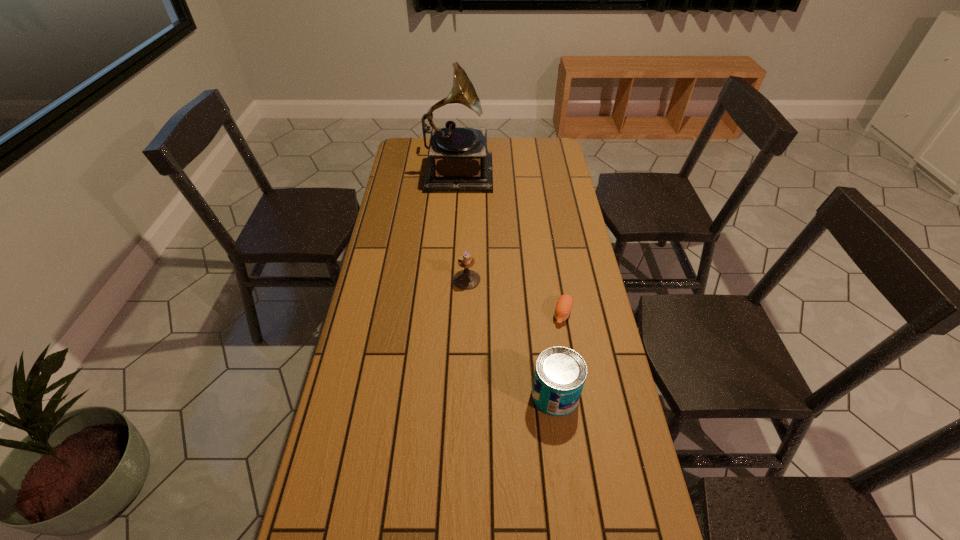
Where is `the tallest object`? This screenshot has width=960, height=540. the tallest object is located at coordinates (458, 160).

You are a GUI agent. You are given a task and a screenshot of the screen. Output one action in this format:
    pyautogui.click(x=<x>, y=<y>)
    Task: Click on the record player
    The height and width of the screenshot is (540, 960).
    Given the screenshot: What is the action you would take?
    pyautogui.click(x=458, y=160)

I want to click on candle holder, so click(466, 279).

This screenshot has width=960, height=540. What are the coordinates of `the nearest object` in the screenshot? It's located at (560, 373).

Where is `the shortest object`? the shortest object is located at coordinates (563, 308).

The width and height of the screenshot is (960, 540). I want to click on sushi, so click(x=563, y=308).

Where is `free space located on the horn of the record player`? This screenshot has width=960, height=540. free space located on the horn of the record player is located at coordinates (538, 170).

Identify the location of free region located 0.090m on the right of the third nearest object. (507, 280).

Image resolution: width=960 pixels, height=540 pixels. Identify the location of vacant space located on the front of the can. (563, 452).

Find the location of `free space located 0.250m on the front of the third farthest object`. free space located 0.250m on the front of the third farthest object is located at coordinates (578, 402).